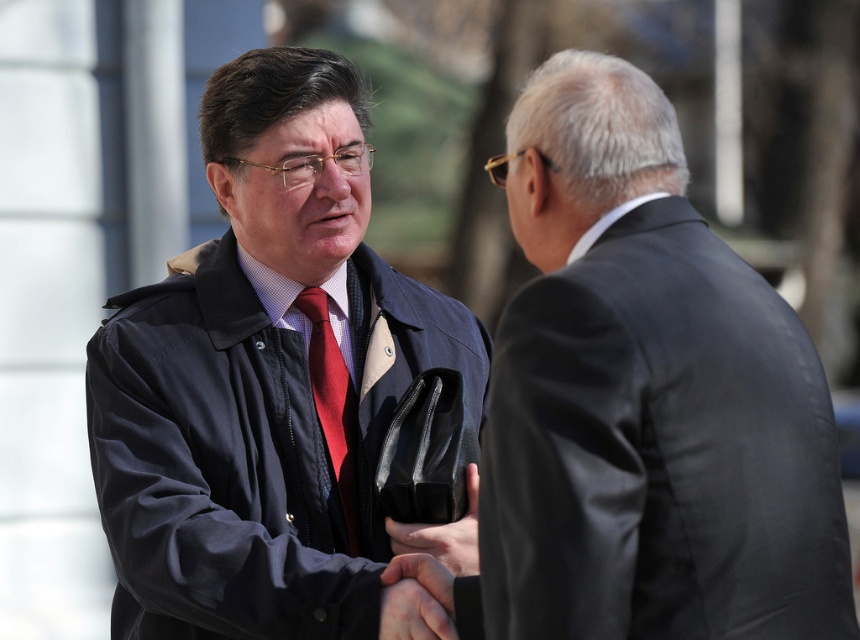
You are standing at the center of the image and want to move towards the point that is closer to you. Which point should you move towards, point (581, 205) or point (321, 420)?

Point (581, 205) is in front of point (321, 420), so you should move towards point (581, 205) as it is closer to you.

You are a photographer adjusting the framing of a portrait. You need to ensure that both the matte black jacket at center and the matte red tie at center are fully visible. Which object requires more horizontal space in the frame?

The matte black jacket at center requires more horizontal space in the frame because its width surpasses that of the matte red tie at center.